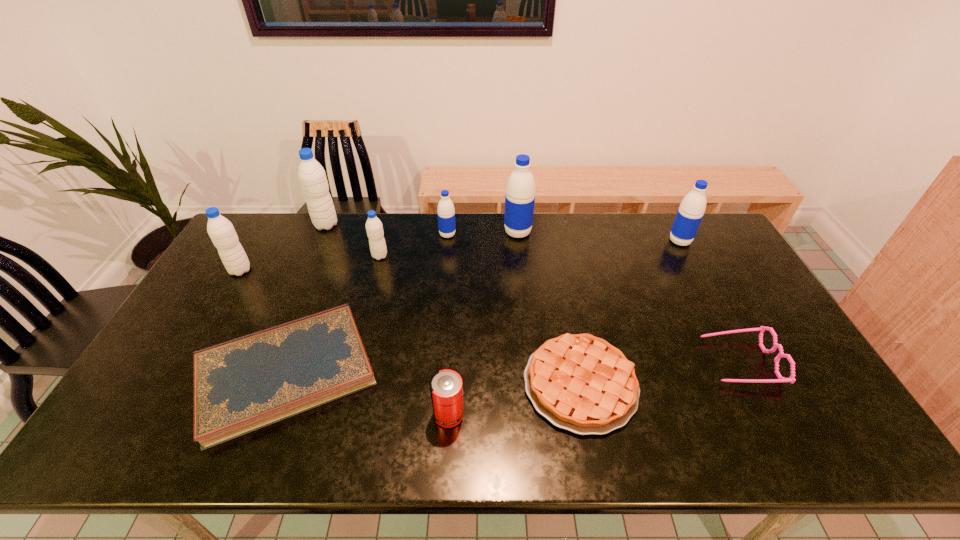
Image resolution: width=960 pixels, height=540 pixels. I want to click on free space at the left edge of the desktop, so click(253, 268).

The image size is (960, 540). I want to click on free space at the right edge, so click(725, 292).

You are a GUI agent. You are given a task and a screenshot of the screen. Output one action in this format:
    pyautogui.click(x=<x>, y=<y>)
    Task: Click on the vacant point located between the nearest water bottle and the pie
    This screenshot has width=960, height=540.
    Given the screenshot: What is the action you would take?
    pyautogui.click(x=410, y=327)

The width and height of the screenshot is (960, 540). Find the location of `vacant area that lies between the second blue water bottle from left to right and the paperback book`. vacant area that lies between the second blue water bottle from left to right and the paperback book is located at coordinates (402, 302).

Identify the location of free space between the shortest object and the pink spectacles. The image size is (960, 540). (513, 367).

Where is `empty space that is in between the second nearest gray water bottle and the leftmost gray water bottle`? The width and height of the screenshot is (960, 540). empty space that is in between the second nearest gray water bottle and the leftmost gray water bottle is located at coordinates pyautogui.click(x=310, y=263).

Locate an element on the screen. The image size is (960, 540). vacant region between the rightmost blue water bottle and the fourth water bottle from left to right is located at coordinates (564, 238).

The width and height of the screenshot is (960, 540). What are the coordinates of `free space between the second biggest blue water bottle and the fifth water bottle from right to left` in the screenshot? It's located at (503, 233).

Where is `vacant point located between the pie and the rightmost water bottle`? This screenshot has width=960, height=540. vacant point located between the pie and the rightmost water bottle is located at coordinates click(x=630, y=313).

Find the location of a particular element. The width and height of the screenshot is (960, 540). vacant area between the smallest blue water bottle and the fifth water bottle from left to right is located at coordinates [483, 234].